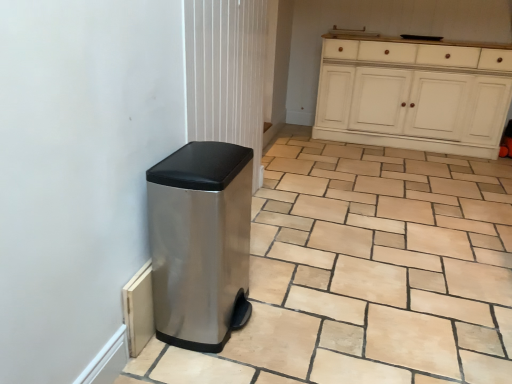
I want to click on free space underneath polished stainless steel trash can at lower left (from a real-world perspective), so click(x=199, y=330).